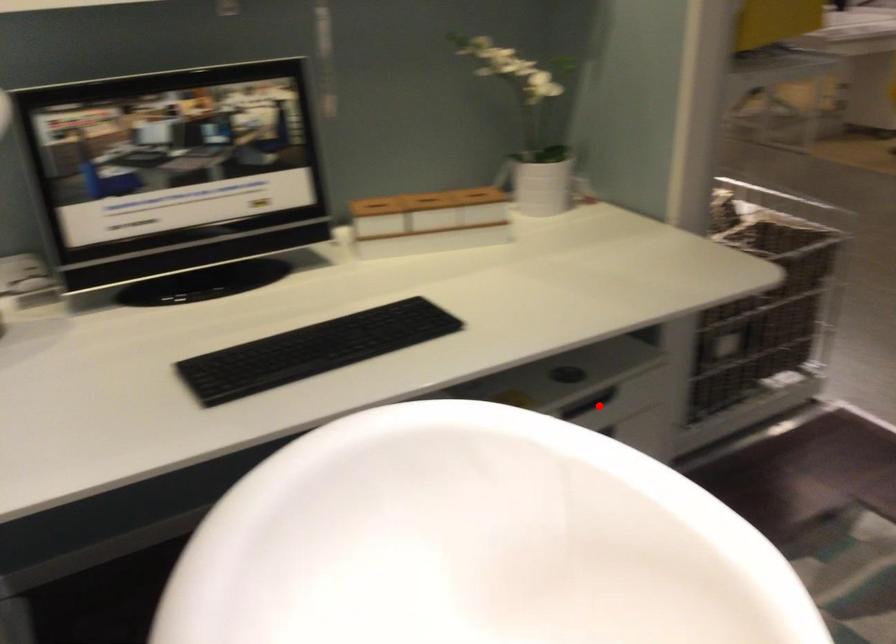
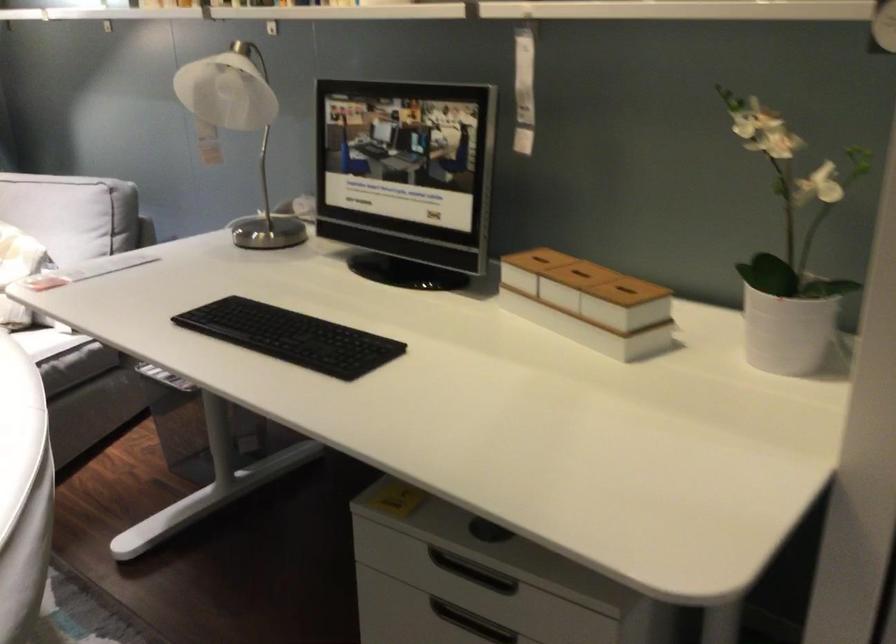
Question: I am providing you with two images of the same scene from different viewpoints. Given a red point in image1, look at the same physical point in image2. Is it:

Choices:
 (A) Closer to the viewpoint
 (B) Farther from the viewpoint

Answer: (A)